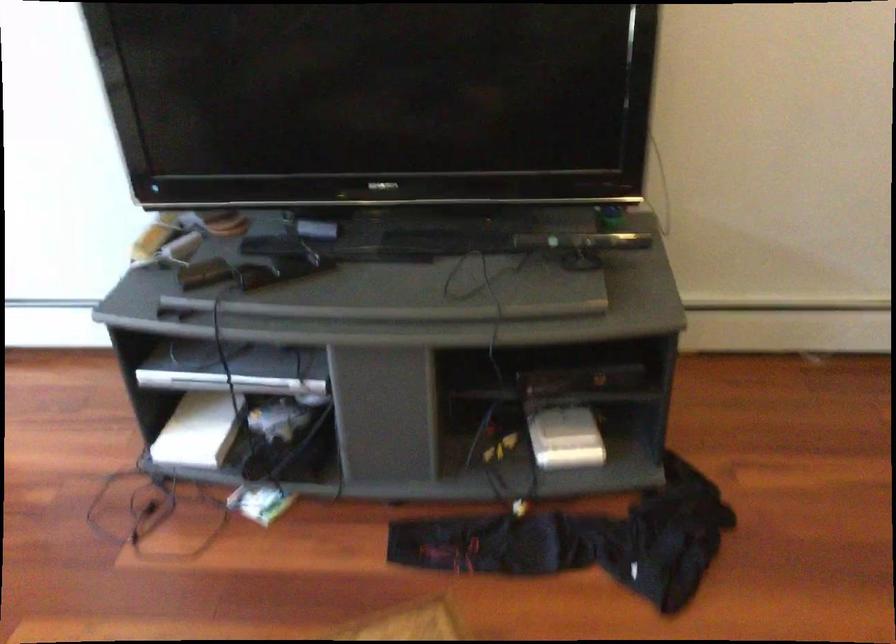
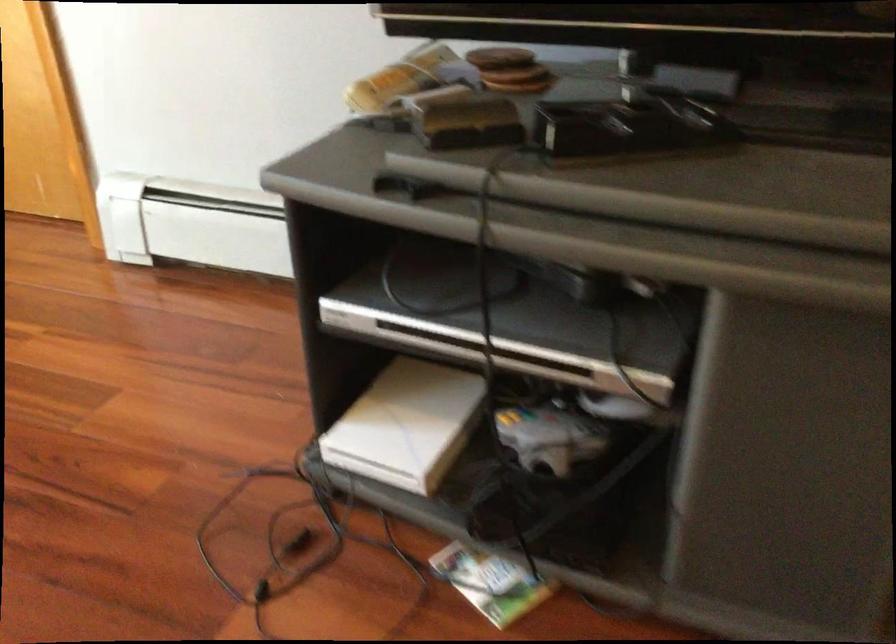
The point at [239,368] is marked in the first image. Where is the corresponding point in the second image?

(505, 321)